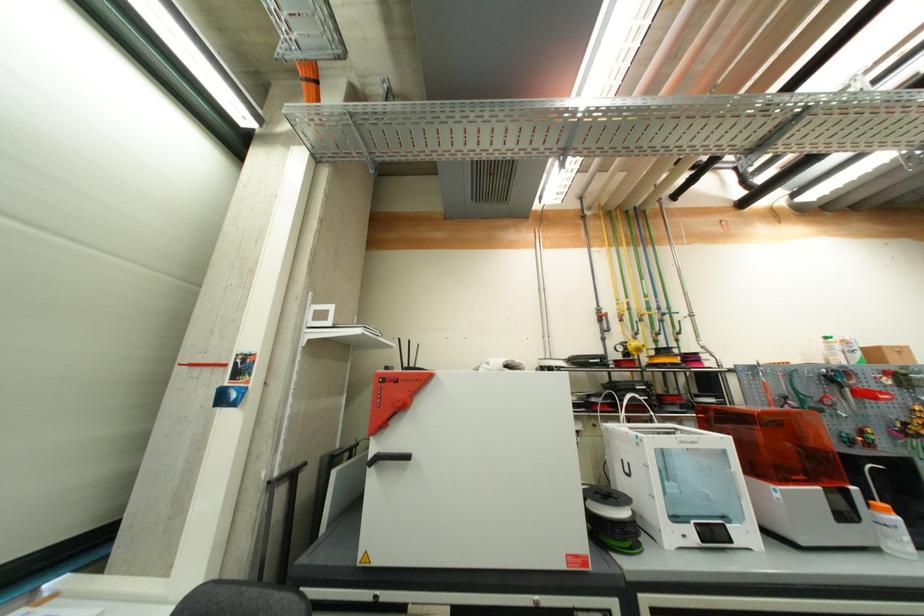
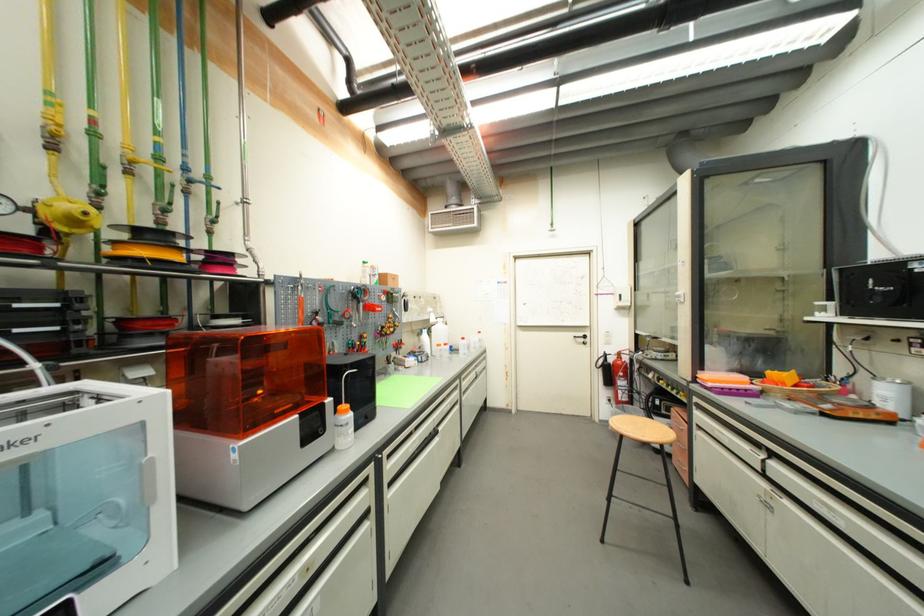
Find the pixel in the second image that matches point (623, 306) in the first image.

(55, 106)